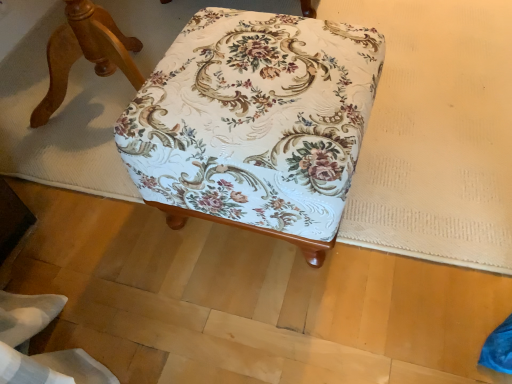
The height and width of the screenshot is (384, 512). What do you see at coordinates (85, 53) in the screenshot?
I see `floral fabric ottoman at center, the second furniture in the right-to-left sequence` at bounding box center [85, 53].

Where is `floral fabric ottoman at center, the second furniture in the right-to-left sequence`? floral fabric ottoman at center, the second furniture in the right-to-left sequence is located at coordinates (85, 53).

How much space does floral fabric ottoman at center, which is counted as the first furniture, starting from the left, occupy vertically?

47.00 centimeters.

Describe the element at coordinates (255, 124) in the screenshot. I see `floral fabric ottoman at center, arranged as the first furniture when viewed from the right` at that location.

I want to click on floral fabric ottoman at center, arranged as the first furniture when viewed from the right, so click(255, 124).

Measure the distance between floral fabric ottoman at center, arranged as the first furniture when viewed from the right, and camera.

The depth of floral fabric ottoman at center, arranged as the first furniture when viewed from the right, is 24.67 inches.

Locate an element on the screen. The width and height of the screenshot is (512, 384). floral fabric ottoman at center, the second furniture in the right-to-left sequence is located at coordinates (85, 53).

Which is more to the right, floral fabric ottoman at center, arranged as the first furniture when viewed from the right, or floral fabric ottoman at center, the second furniture in the right-to-left sequence?

Positioned to the right is floral fabric ottoman at center, arranged as the first furniture when viewed from the right.

Is floral fabric ottoman at center, arranged as the first furniture when viewed from the right, in front of or behind floral fabric ottoman at center, the second furniture in the right-to-left sequence, in the image?

floral fabric ottoman at center, arranged as the first furniture when viewed from the right, is in front of floral fabric ottoman at center, the second furniture in the right-to-left sequence.

Which is behind, point (300, 174) or point (134, 40)?

Positioned behind is point (134, 40).

From the image's perspective, which is above, floral fabric ottoman at center, arranged as the first furniture when viewed from the right, or floral fabric ottoman at center, which is counted as the first furniture, starting from the left?

floral fabric ottoman at center, which is counted as the first furniture, starting from the left.

In the scene shown: From a real-world perspective, which is physically above, floral fabric ottoman at center, which is the 2th furniture in left-to-right order, or floral fabric ottoman at center, the second furniture in the right-to-left sequence?

floral fabric ottoman at center, the second furniture in the right-to-left sequence, is physically above.

Between floral fabric ottoman at center, which is the 2th furniture in left-to-right order, and floral fabric ottoman at center, which is counted as the first furniture, starting from the left, which one has smaller width?

floral fabric ottoman at center, which is the 2th furniture in left-to-right order.

Who is taller, floral fabric ottoman at center, arranged as the first furniture when viewed from the right, or floral fabric ottoman at center, which is counted as the first furniture, starting from the left?

floral fabric ottoman at center, which is counted as the first furniture, starting from the left.

Does floral fabric ottoman at center, arranged as the first furniture when viewed from the right, have a larger size compared to floral fabric ottoman at center, the second furniture in the right-to-left sequence?

No, floral fabric ottoman at center, arranged as the first furniture when viewed from the right, is not bigger than floral fabric ottoman at center, the second furniture in the right-to-left sequence.

Which is correct: floral fabric ottoman at center, arranged as the first furniture when viewed from the right, is inside floral fabric ottoman at center, which is counted as the first furniture, starting from the left, or outside of it?

floral fabric ottoman at center, arranged as the first furniture when viewed from the right, is outside floral fabric ottoman at center, which is counted as the first furniture, starting from the left.

Is floral fabric ottoman at center, which is the 2th furniture in left-to-right order, far from floral fabric ottoman at center, which is counted as the first furniture, starting from the left?

floral fabric ottoman at center, which is the 2th furniture in left-to-right order, is actually quite close to floral fabric ottoman at center, which is counted as the first furniture, starting from the left.

Is floral fabric ottoman at center, arranged as the first furniture when viewed from the right, looking in the opposite direction of floral fabric ottoman at center, which is counted as the first furniture, starting from the left?

No.

The height and width of the screenshot is (384, 512). I want to click on furniture located on the left of floral fabric ottoman at center, which is the 2th furniture in left-to-right order, so click(85, 53).

Considering the positions of objects floral fabric ottoman at center, the second furniture in the right-to-left sequence, and floral fabric ottoman at center, arranged as the first furniture when viewed from the right, in the image provided, who is more to the left, floral fabric ottoman at center, the second furniture in the right-to-left sequence, or floral fabric ottoman at center, arranged as the first furniture when viewed from the right,?

floral fabric ottoman at center, the second furniture in the right-to-left sequence.

Which is behind, floral fabric ottoman at center, which is counted as the first furniture, starting from the left, or floral fabric ottoman at center, which is the 2th furniture in left-to-right order?

floral fabric ottoman at center, which is counted as the first furniture, starting from the left, is further away from the camera.

Is point (66, 84) closer or farther from the camera than point (303, 41)?

Point (66, 84).

From the image's perspective, is floral fabric ottoman at center, the second furniture in the right-to-left sequence, over floral fabric ottoman at center, arranged as the first furniture when viewed from the right?

Yes.

From a real-world perspective, is floral fabric ottoman at center, which is counted as the first furniture, starting from the left, positioned above or below floral fabric ottoman at center, which is the 2th furniture in left-to-right order?

From a real-world perspective, floral fabric ottoman at center, which is counted as the first furniture, starting from the left, is physically above floral fabric ottoman at center, which is the 2th furniture in left-to-right order.

Considering the sizes of objects floral fabric ottoman at center, the second furniture in the right-to-left sequence, and floral fabric ottoman at center, which is the 2th furniture in left-to-right order, in the image provided, who is wider, floral fabric ottoman at center, the second furniture in the right-to-left sequence, or floral fabric ottoman at center, which is the 2th furniture in left-to-right order,?

Wider between the two is floral fabric ottoman at center, the second furniture in the right-to-left sequence.

Considering the sizes of floral fabric ottoman at center, which is counted as the first furniture, starting from the left, and floral fabric ottoman at center, arranged as the first furniture when viewed from the right, in the image, is floral fabric ottoman at center, which is counted as the first furniture, starting from the left, taller or shorter than floral fabric ottoman at center, arranged as the first furniture when viewed from the right,?

In the image, floral fabric ottoman at center, which is counted as the first furniture, starting from the left, appears to be taller than floral fabric ottoman at center, arranged as the first furniture when viewed from the right.

Does floral fabric ottoman at center, which is counted as the first furniture, starting from the left, have a larger size compared to floral fabric ottoman at center, which is the 2th furniture in left-to-right order?

Yes.

Would you say floral fabric ottoman at center, arranged as the first furniture when viewed from the right, is part of floral fabric ottoman at center, which is counted as the first furniture, starting from the left,'s contents?

No, floral fabric ottoman at center, arranged as the first furniture when viewed from the right, is not inside floral fabric ottoman at center, which is counted as the first furniture, starting from the left.

Is floral fabric ottoman at center, the second furniture in the right-to-left sequence, touching floral fabric ottoman at center, arranged as the first furniture when viewed from the right?

floral fabric ottoman at center, the second furniture in the right-to-left sequence, is not next to floral fabric ottoman at center, arranged as the first furniture when viewed from the right, and they're not touching.

Is floral fabric ottoman at center, the second furniture in the right-to-left sequence, oriented towards floral fabric ottoman at center, arranged as the first furniture when viewed from the right?

Yes, floral fabric ottoman at center, the second furniture in the right-to-left sequence, is oriented towards floral fabric ottoman at center, arranged as the first furniture when viewed from the right.

Can you tell me how much floral fabric ottoman at center, the second furniture in the right-to-left sequence, and floral fabric ottoman at center, which is the 2th furniture in left-to-right order, differ in facing direction?

177 degrees separate the facing orientations of floral fabric ottoman at center, the second furniture in the right-to-left sequence, and floral fabric ottoman at center, which is the 2th furniture in left-to-right order.

Where is `furniture on the right of floral fabric ottoman at center, the second furniture in the right-to-left sequence`? furniture on the right of floral fabric ottoman at center, the second furniture in the right-to-left sequence is located at coordinates [x=255, y=124].

Where is `furniture above the floral fabric ottoman at center, which is the 2th furniture in left-to-right order (from the image's perspective)`? This screenshot has width=512, height=384. furniture above the floral fabric ottoman at center, which is the 2th furniture in left-to-right order (from the image's perspective) is located at coordinates (85, 53).

Where is `furniture directly beneath the floral fabric ottoman at center, which is counted as the first furniture, starting from the left (from a real-world perspective)`? The width and height of the screenshot is (512, 384). furniture directly beneath the floral fabric ottoman at center, which is counted as the first furniture, starting from the left (from a real-world perspective) is located at coordinates (255, 124).